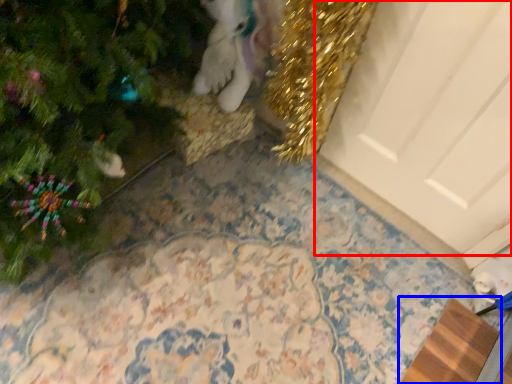
Question: Among these objects, which one is nearest to the camera, door (highlighted by a red box) or doormat (highlighted by a blue box)?

Choices:
 (A) door
 (B) doormat

Answer: (A)